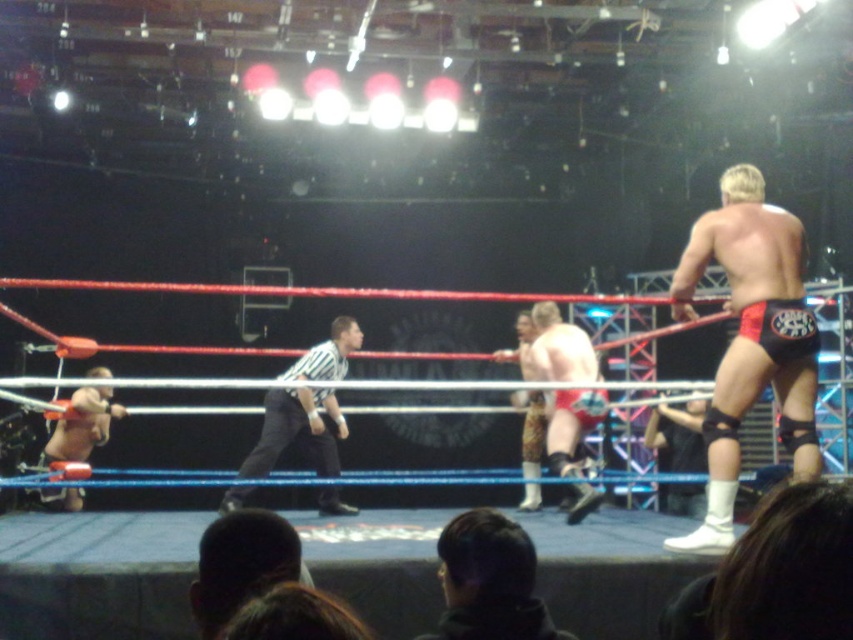
Question: Is red fabric shorts at right below matte red shorts at lower left?

Choices:
 (A) no
 (B) yes

Answer: (A)

Question: Is dark hair at lower center wider than camouflage-patterned shorts at center?

Choices:
 (A) yes
 (B) no

Answer: (B)

Question: Is red fabric shorts at right closer to the viewer compared to camouflage-patterned shorts at center?

Choices:
 (A) no
 (B) yes

Answer: (B)

Question: Which of the following is the farthest from the observer?

Choices:
 (A) matte red shorts at lower left
 (B) red fabric shorts at right
 (C) striped fabric referee at center
 (D) red leather boots at center

Answer: (A)

Question: Which object is positioned closest to the striped fabric referee at center?

Choices:
 (A) red leather boots at center
 (B) camouflage-patterned shorts at center

Answer: (B)

Question: Among these objects, which one is farthest from the camera?

Choices:
 (A) black leather jacket at lower center
 (B) red fabric shorts at right
 (C) red leather boots at center

Answer: (C)